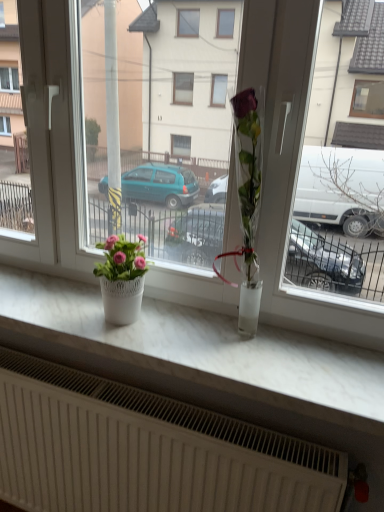
Identify the location of free space above white textured radiator at lower center (from a real-world perspective). This screenshot has width=384, height=512. (121, 393).